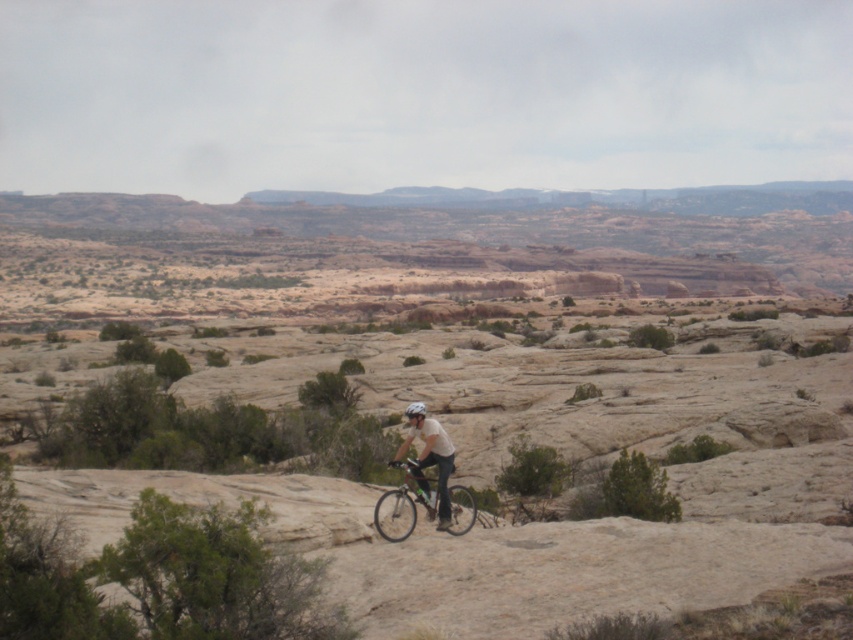
You are a photographer trying to capture a clear shot of both the white matte helmet at center and the shiny silver helmet at center. Since you want to focus on the helmets, you need to know their arrangement. Which helmet is located to the right of the other?

The white matte helmet at center is positioned on the right side of shiny silver helmet at center.

You are a photographer planning to take a photo of the desert sandstone terrain at center and the metallic silver bicycle at center. From your current position, which object will appear larger in the photo?

The desert sandstone terrain at center will appear larger in the photo because it is closer to the viewer than the metallic silver bicycle at center.